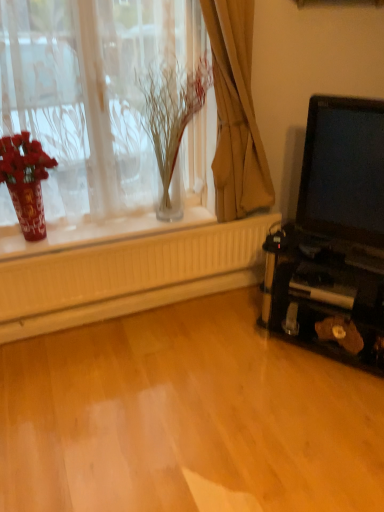
Question: Does brown fabric curtain at upper center lie in front of matte black laptop at right?

Choices:
 (A) yes
 (B) no

Answer: (B)

Question: From the image's perspective, is brown fabric curtain at upper center located above matte black laptop at right?

Choices:
 (A) no
 (B) yes

Answer: (B)

Question: From a real-world perspective, is brown fabric curtain at upper center physically below matte black laptop at right?

Choices:
 (A) no
 (B) yes

Answer: (A)

Question: Can we say brown fabric curtain at upper center lies outside matte black laptop at right?

Choices:
 (A) yes
 (B) no

Answer: (A)

Question: Is brown fabric curtain at upper center looking in the opposite direction of matte black laptop at right?

Choices:
 (A) no
 (B) yes

Answer: (A)

Question: Is brown fabric curtain at upper center next to matte black laptop at right?

Choices:
 (A) yes
 (B) no

Answer: (B)

Question: Are brown fabric curtain at upper center and translucent glass vase at upper center beside each other?

Choices:
 (A) no
 (B) yes

Answer: (A)

Question: From the image's perspective, would you say brown fabric curtain at upper center is positioned over translucent glass vase at upper center?

Choices:
 (A) no
 (B) yes

Answer: (B)

Question: Does brown fabric curtain at upper center lie in front of translucent glass vase at upper center?

Choices:
 (A) no
 (B) yes

Answer: (B)

Question: Can you confirm if brown fabric curtain at upper center is thinner than translucent glass vase at upper center?

Choices:
 (A) yes
 (B) no

Answer: (A)

Question: Is brown fabric curtain at upper center far away from translucent glass vase at upper center?

Choices:
 (A) yes
 (B) no

Answer: (B)

Question: From the image's perspective, is brown fabric curtain at upper center below translucent glass vase at upper center?

Choices:
 (A) yes
 (B) no

Answer: (B)

Question: Is brown fabric curtain at upper center oriented away from translucent glass vase at upper left?

Choices:
 (A) yes
 (B) no

Answer: (A)